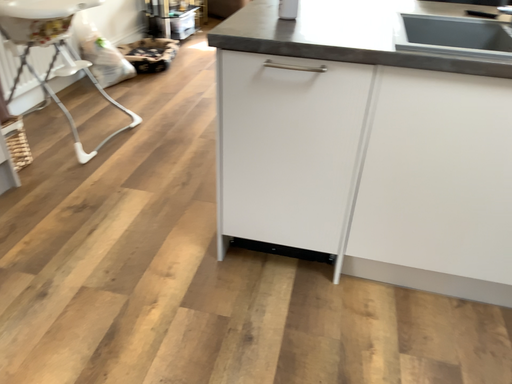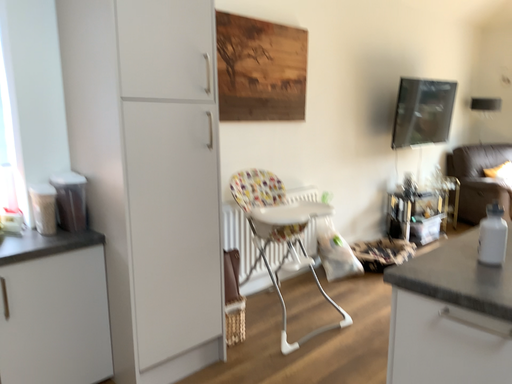
Question: How did the camera likely rotate when shooting the video?

Choices:
 (A) rotated right
 (B) rotated left

Answer: (B)